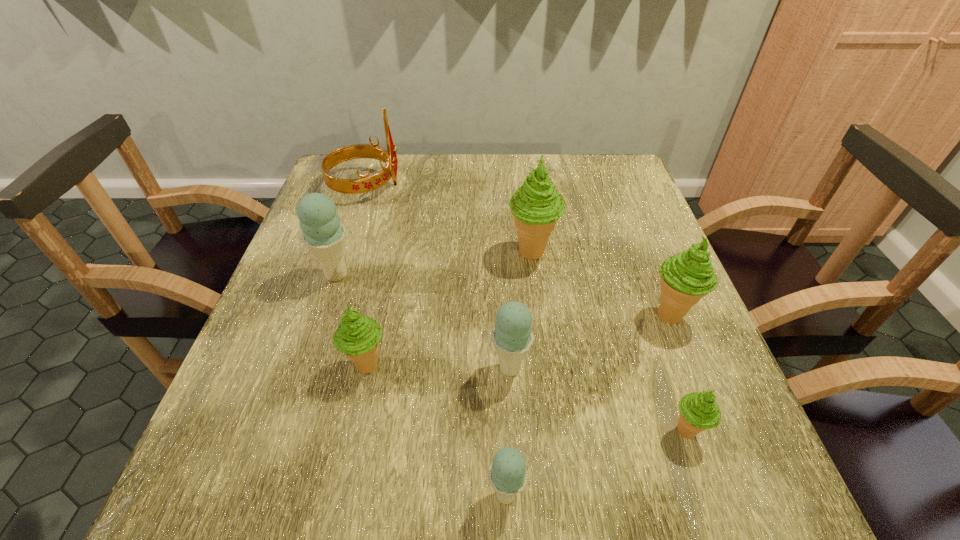
Image resolution: width=960 pixels, height=540 pixels. In order to click on the farthest green icecream in this screenshot , I will do `click(536, 206)`.

Locate an element on the screen. the tallest ice cream is located at coordinates (536, 206).

At what (x,y) coordinates should I click in order to perform the action: click on tiara. Please return your answer as a coordinate pair (x, y). This screenshot has width=960, height=540. Looking at the image, I should click on (365, 183).

At what (x,y) coordinates should I click in order to perform the action: click on red tiara. Please return your answer as a coordinate pair (x, y). Image resolution: width=960 pixels, height=540 pixels. Looking at the image, I should click on (365, 183).

The height and width of the screenshot is (540, 960). Find the location of `the leftmost ice cream`. the leftmost ice cream is located at coordinates (324, 235).

Image resolution: width=960 pixels, height=540 pixels. Find the location of `the biggest blue ice cream`. the biggest blue ice cream is located at coordinates (324, 235).

Find the location of a particular element. the fifth nearest object is located at coordinates (685, 278).

Locate an element on the screen. Image resolution: width=960 pixels, height=540 pixels. the third smallest green icecream is located at coordinates pyautogui.click(x=685, y=278).

What are the coordinates of `the second nearest blue ice cream` in the screenshot? It's located at (512, 336).

I want to click on the third farthest green icecream, so click(x=358, y=336).